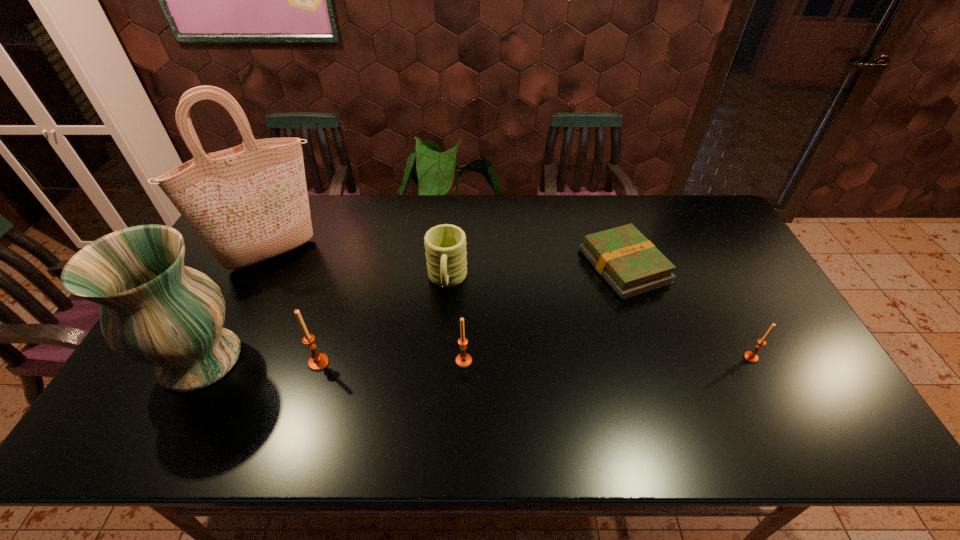
You are a GUI agent. You are given a task and a screenshot of the screen. Output one action in this format:
    pyautogui.click(x=<x>, y=<y>)
    Task: Click on the leftmost candle_holder
    This screenshot has width=960, height=540.
    Given the screenshot: What is the action you would take?
    pyautogui.click(x=318, y=361)

Image resolution: width=960 pixels, height=540 pixels. I want to click on the third object from left to right, so click(318, 361).

Identify the location of the second candle_holder from right to left. pos(463,360).

This screenshot has width=960, height=540. Find the location of `the rightmost candle_holder`. the rightmost candle_holder is located at coordinates (751, 356).

Where is `the shortest candle_holder`? The height and width of the screenshot is (540, 960). the shortest candle_holder is located at coordinates (751, 356).

This screenshot has width=960, height=540. What are the coordinates of `the tallest object` in the screenshot? It's located at (249, 203).

The image size is (960, 540). In order to click on book in this screenshot , I will do `click(631, 264)`.

Where is `the sixth object from left to right`? This screenshot has width=960, height=540. the sixth object from left to right is located at coordinates (631, 264).

Where is `mug`? This screenshot has width=960, height=540. mug is located at coordinates click(445, 245).

Identify the location of the sixth shortest object. This screenshot has height=540, width=960. (155, 311).